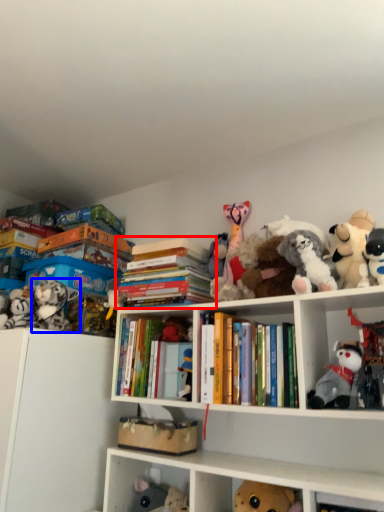
Question: Among these objects, which one is nearest to the camera, book (highlighted by a red box) or toy (highlighted by a blue box)?

Choices:
 (A) book
 (B) toy

Answer: (A)